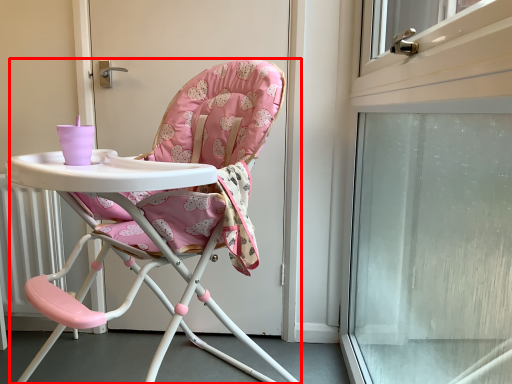
Question: From the image's perspective, considering the relative positions of chair (annotated by the red box) and screen door in the image provided, where is chair (annotated by the red box) located with respect to the staircase?

Choices:
 (A) above
 (B) below

Answer: (B)